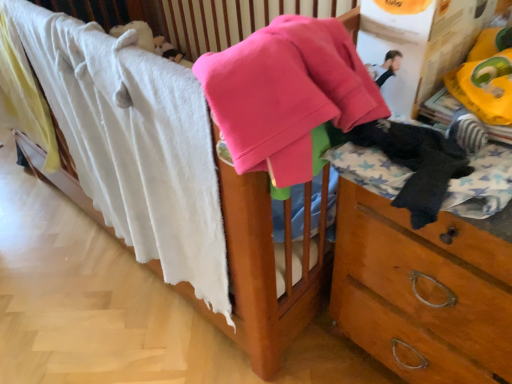
Question: Considering the positions of point (309, 69) and point (114, 218), is point (309, 69) closer or farther from the camera than point (114, 218)?

Choices:
 (A) closer
 (B) farther

Answer: (A)

Question: Is pink fleece sweater at upper center spatially inside white soft towel at upper left, or outside of it?

Choices:
 (A) inside
 (B) outside

Answer: (B)

Question: Estimate the real-world distances between objects in this image. Which object is closer to the black fuzzy socks at right?

Choices:
 (A) pink fleece sweater at upper center
 (B) white soft towel at upper left

Answer: (A)

Question: Estimate the real-world distances between objects in this image. Which object is farther from the black fuzzy socks at right?

Choices:
 (A) white soft towel at upper left
 (B) pink fleece sweater at upper center

Answer: (A)